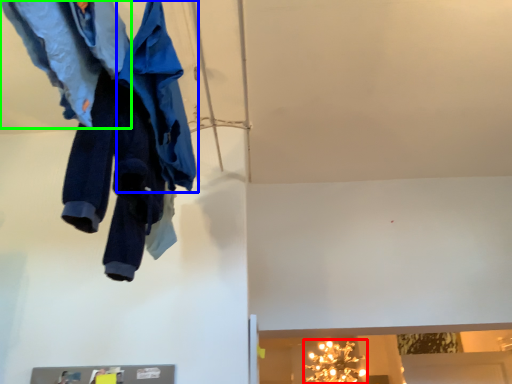
Question: Based on their relative distances, which object is nearer to light fixture (highlighted by a red box)? Choose from cloak (highlighted by a blue box) and trousers (highlighted by a green box).

Choices:
 (A) cloak
 (B) trousers

Answer: (A)